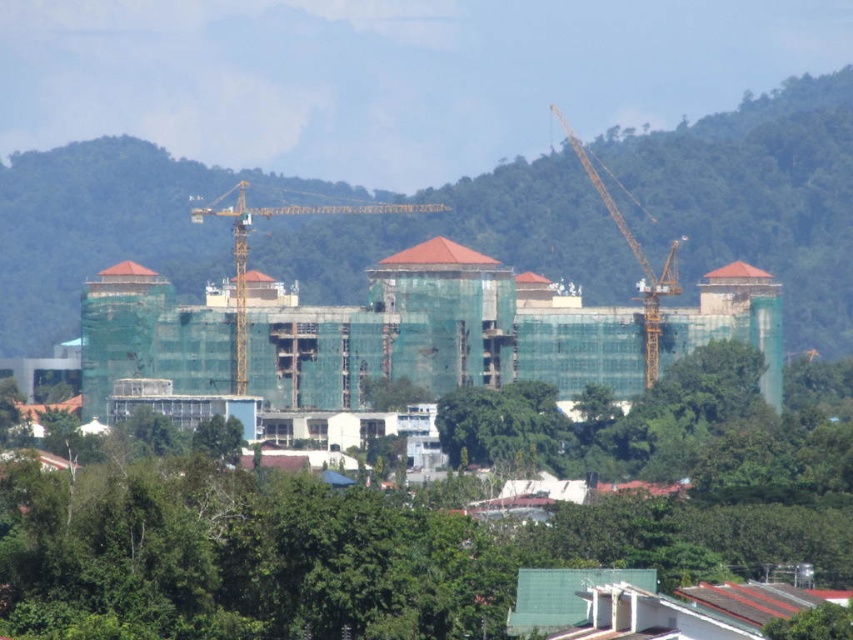
Question: Does yellow metallic crane at center have a greater width compared to yellow metallic crane at right?

Choices:
 (A) yes
 (B) no

Answer: (A)

Question: Does green leafy tree at center appear over green netting building at center?

Choices:
 (A) no
 (B) yes

Answer: (A)

Question: Does yellow metallic crane at center appear on the left side of yellow metallic crane at right?

Choices:
 (A) no
 (B) yes

Answer: (B)

Question: Which of the following is the closest to the observer?

Choices:
 (A) (186, 540)
 (B) (628, 246)

Answer: (A)

Question: Which of these objects is positioned closest to the green leafy tree at center?

Choices:
 (A) yellow metallic crane at right
 (B) green netting building at center
 (C) yellow metallic crane at center

Answer: (B)

Question: Which point is farther to the camera?

Choices:
 (A) yellow metallic crane at center
 (B) green leafy tree at center

Answer: (A)